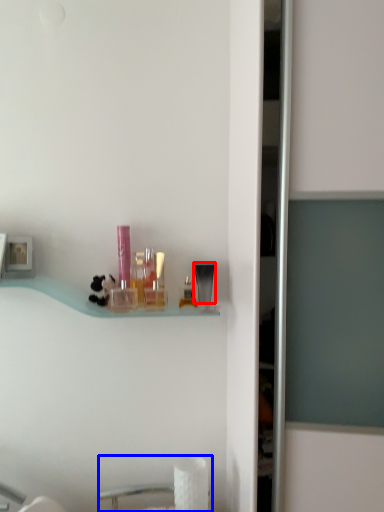
Question: Which point is closer to the camera, toiletry (highlighted by a red box) or sink (highlighted by a blue box)?

Choices:
 (A) toiletry
 (B) sink

Answer: (B)